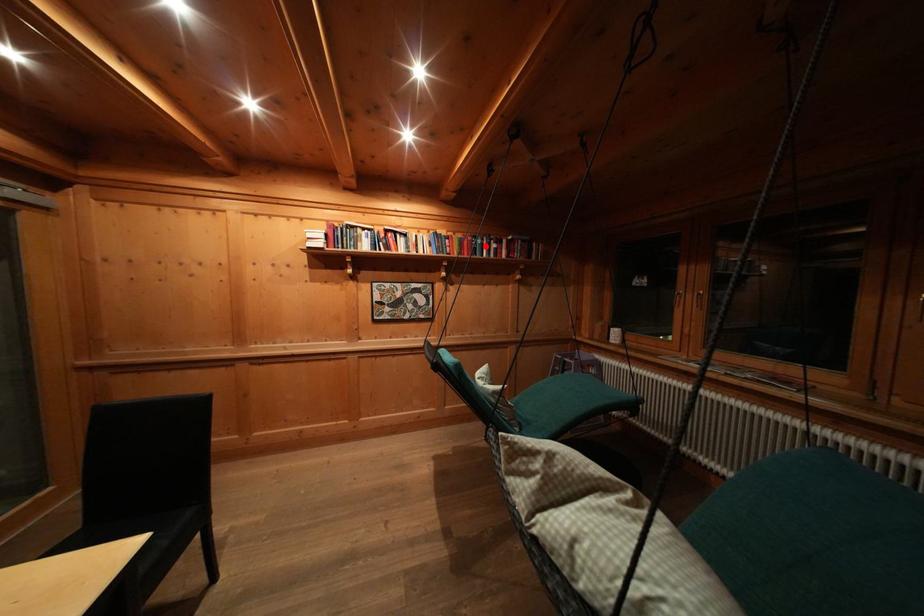
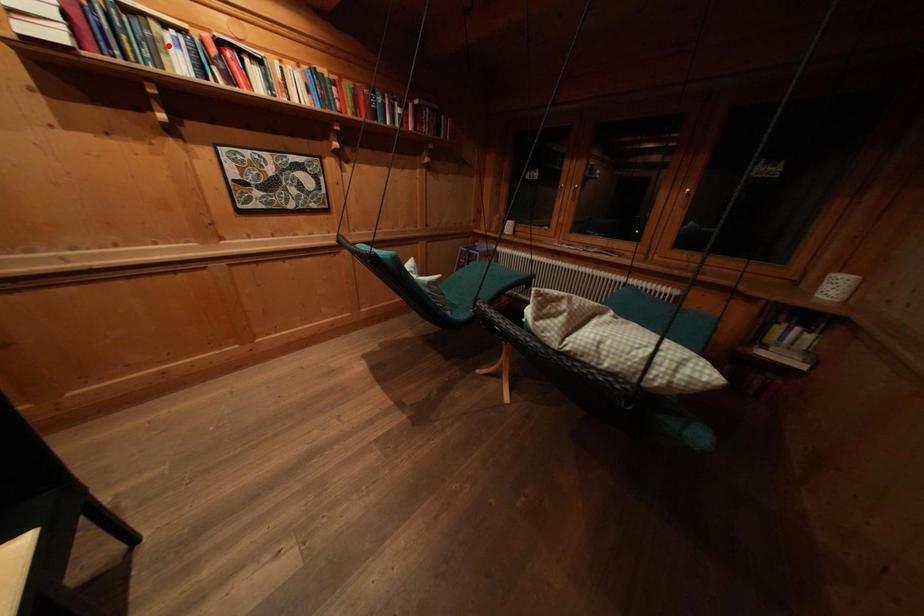
Consider the image. I am providing you with two images of the same scene from different viewpoints. A red point is marked on the first image and another point is marked on the second image. Is the red point in image1 aligned with the point shown in image2?

No